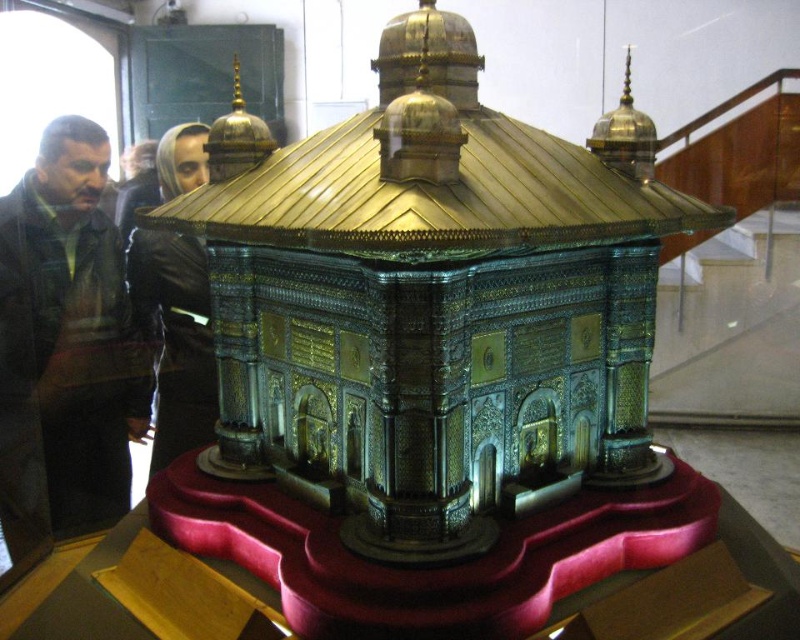
You are a tailor measuring the distance between two jackets displayed on a red cushioned platform. The jackets are the brushed metal jacket at left and the black leather jacket at center. The tailor needs to know if there is enough space between them to place a 15 inch wide tailor box. Can the tailor fit the box between them?

The brushed metal jacket at left and the black leather jacket at center are 14.78 inches apart. Since the tailor box is 15 inches wide, which is slightly wider than the space between them, the tailor cannot fit the box between them.

You are an interior designer who needs to place a new decorative item on the red cushioned platform. However, you must ensure it doesn not block the view of the brushed metal jacket at left. Where should you place the new item?

Place the new decorative item away from the brushed metal jacket at left, ensuring it does not obstruct the view of the brushed metal jacket at left located at point (72, 326).

You are standing in front of the miniature mosque model and want to touch the two points marked on the model. The first point is at coordinate point (88, 365) and the second is at point (160, 417). Which point will you reach first if you move towards them from your current position?

Point (88, 365) is closer to the viewer than point (160, 417), so you will reach the point (88, 365) first.